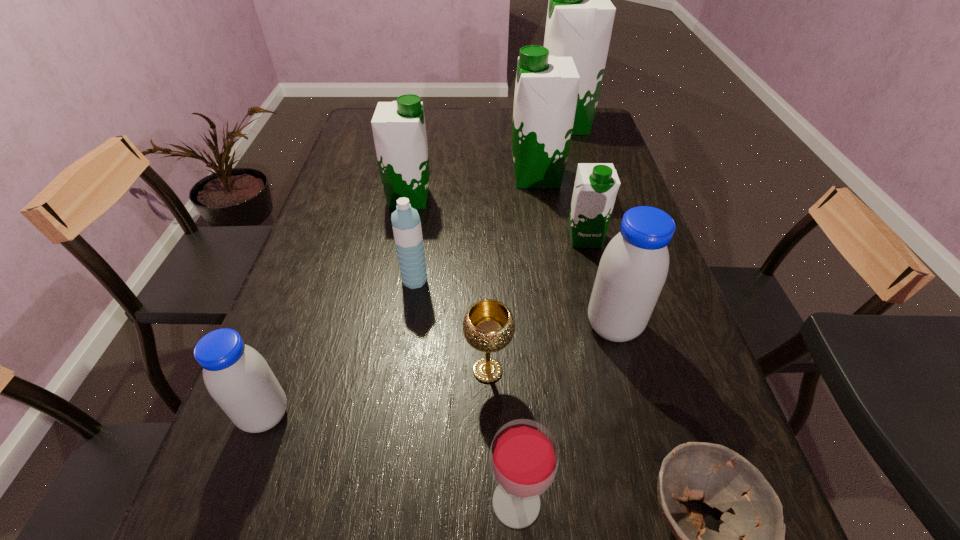
Identify the location of vacant space that is in between the fifth shortest soya milk and the fourth nearest object. Image resolution: width=960 pixels, height=540 pixels. (513, 274).

Where is `vacant area between the blue water bottle and the tallest object`? vacant area between the blue water bottle and the tallest object is located at coordinates (490, 202).

Identify the location of vacant space that is in between the wineglass and the water bottle. (466, 391).

The width and height of the screenshot is (960, 540). Identify the location of object that is the second closest to the leftmost object. (488, 326).

Point out which object is positioned as the seventh nearest to the leftmost green soya milk. Please provide its 2D coordinates. Your answer should be formatted as a tuple, i.e. [(x, y)], where the tuple contains the x and y coordinates of a point satisfying the conditions above.

[(238, 378)]

The image size is (960, 540). What are the coordinates of `soya milk identified as the third closest to the ninth shortest object` in the screenshot? It's located at (399, 131).

Locate which soya milk ranks fifth in proximity to the chalice. Please provide its 2D coordinates. Your answer should be formatted as a tuple, i.e. [(x, y)], where the tuple contains the x and y coordinates of a point satisfying the conditions above.

[(546, 90)]

At what (x,y) coordinates should I click in order to perform the action: click on green soya milk object that ranks as the second closest to the bowl. Please return your answer as a coordinate pair (x, y). The width and height of the screenshot is (960, 540). Looking at the image, I should click on (546, 90).

Locate which green soya milk ranks in proximity to the seventh nearest object. Please provide its 2D coordinates. Your answer should be formatted as a tuple, i.e. [(x, y)], where the tuple contains the x and y coordinates of a point satisfying the conditions above.

[(546, 90)]

Find the location of `free region that satisfies the following two spatial constraints: 1. on the back side of the wineglass; 2. on the front-facing side of the second soya milk from left to right`. free region that satisfies the following two spatial constraints: 1. on the back side of the wineglass; 2. on the front-facing side of the second soya milk from left to right is located at coordinates (500, 199).